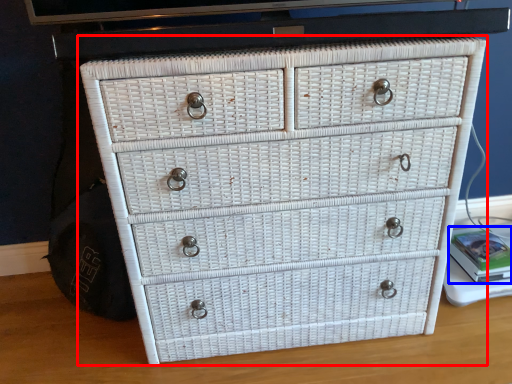
Question: Which point is further to the camera, chest of drawers (highlighted by a red box) or book (highlighted by a blue box)?

Choices:
 (A) chest of drawers
 (B) book

Answer: (B)